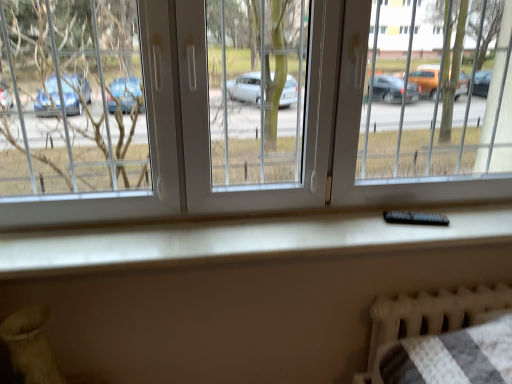
From the picture: In order to face transparent plastic window at center, should I rotate leftwards or rightwards?

To align with it, rotate right about 4.572°.

Describe the element at coordinates (203, 122) in the screenshot. I see `transparent plastic window at center` at that location.

Measure the distance between white textured radiator at lower right and camera.

white textured radiator at lower right and camera are 1.47 meters apart from each other.

Image resolution: width=512 pixels, height=384 pixels. Find the location of `white textured radiator at lower right`. white textured radiator at lower right is located at coordinates (430, 315).

At what (x,y) coordinates should I click in order to perform the action: click on transparent plastic window at center. Please return your answer as a coordinate pair (x, y). The height and width of the screenshot is (384, 512). Looking at the image, I should click on (203, 122).

Which of these two, transparent plastic window at center or white textured radiator at lower right, is smaller?

white textured radiator at lower right.

Is transparent plastic window at center placed right next to white textured radiator at lower right?

They are not placed beside each other.

In terms of width, does transparent plastic window at center look wider or thinner when compared to white textured radiator at lower right?

transparent plastic window at center is wider than white textured radiator at lower right.

Which is in front, white textured radiator at lower right or black plastic remote at center?

black plastic remote at center is more forward.

Can we say white textured radiator at lower right lies outside black plastic remote at center?

white textured radiator at lower right is positioned outside black plastic remote at center.

Between white textured radiator at lower right and black plastic remote at center, which one appears on the right side from the viewer's perspective?

From the viewer's perspective, white textured radiator at lower right appears more on the right side.

In terms of height, does white textured radiator at lower right look taller or shorter compared to black plastic remote at center?

In the image, white textured radiator at lower right appears to be taller than black plastic remote at center.

From the image's perspective, which one is positioned lower, black plastic remote at center or white textured radiator at lower right?

white textured radiator at lower right, from the image's perspective.

Does black plastic remote at center turn towards white textured radiator at lower right?

No, black plastic remote at center is not facing towards white textured radiator at lower right.

Considering the positions of objects black plastic remote at center and white textured radiator at lower right in the image provided, who is in front, black plastic remote at center or white textured radiator at lower right?

black plastic remote at center is closer to the camera.

Is black plastic remote at center to the left or to the right of white textured radiator at lower right in the image?

Based on their positions, black plastic remote at center is located to the left of white textured radiator at lower right.

Does black plastic remote at center lie in front of transparent plastic window at center?

No.

Is black plastic remote at center outside of transparent plastic window at center?

No, black plastic remote at center is inside or overlapping with transparent plastic window at center.

Considering the sizes of objects black plastic remote at center and transparent plastic window at center in the image provided, who is shorter, black plastic remote at center or transparent plastic window at center?

With less height is black plastic remote at center.

Is the position of white textured radiator at lower right more distant than that of transparent plastic window at center?

That is True.

Is white textured radiator at lower right not close to transparent plastic window at center?

white textured radiator at lower right is actually quite close to transparent plastic window at center.

Considering the relative sizes of white textured radiator at lower right and transparent plastic window at center in the image provided, is white textured radiator at lower right shorter than transparent plastic window at center?

Yes.

Is white textured radiator at lower right facing away from transparent plastic window at center?

No.

Is transparent plastic window at center turned away from black plastic remote at center?

No, transparent plastic window at center's orientation is not away from black plastic remote at center.

Considering the positions of point (343, 0) and point (424, 212), is point (343, 0) closer or farther from the camera than point (424, 212)?

Point (343, 0) is positioned closer to the camera compared to point (424, 212).

Who is smaller, transparent plastic window at center or black plastic remote at center?

With smaller size is black plastic remote at center.

From a real-world perspective, which is physically below, transparent plastic window at center or black plastic remote at center?

black plastic remote at center, from a real-world perspective.

I want to click on bed frame behind the transparent plastic window at center, so click(430, 315).

Locate an element on the screen. remote on the left of white textured radiator at lower right is located at coordinates (415, 218).

Looking at the image, which one is located further to transparent plastic window at center, black plastic remote at center or white textured radiator at lower right?

Based on the image, white textured radiator at lower right appears to be further to transparent plastic window at center.

Looking at the image, which one is located closer to black plastic remote at center, transparent plastic window at center or white textured radiator at lower right?

The object closer to black plastic remote at center is white textured radiator at lower right.

Estimate the real-world distances between objects in this image. Which object is closer to black plastic remote at center, white textured radiator at lower right or transparent plastic window at center?

white textured radiator at lower right is positioned closer to the anchor black plastic remote at center.

Considering their positions, is black plastic remote at center positioned further to white textured radiator at lower right than transparent plastic window at center?

transparent plastic window at center lies further to white textured radiator at lower right than the other object.

From the image, which object appears to be nearer to transparent plastic window at center, white textured radiator at lower right or black plastic remote at center?

Among the two, black plastic remote at center is located nearer to transparent plastic window at center.

Considering their positions, is transparent plastic window at center positioned closer to white textured radiator at lower right than black plastic remote at center?

black plastic remote at center is closer to white textured radiator at lower right.

The height and width of the screenshot is (384, 512). I want to click on remote between transparent plastic window at center and white textured radiator at lower right in the up-down direction, so (x=415, y=218).